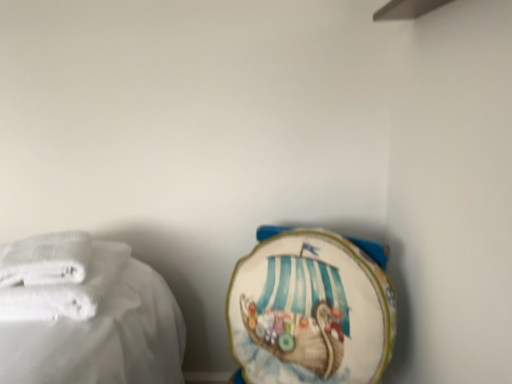
At what (x,y) coordinates should I click in order to perform the action: click on white soft towel at left, placed as the 3th towel when sorted from right to left. Please return your answer as a coordinate pair (x, y). Looking at the image, I should click on (67, 290).

This screenshot has height=384, width=512. I want to click on white fabric towel at lower right, which is counted as the 3th towel, starting from the left, so click(x=310, y=311).

The width and height of the screenshot is (512, 384). What are the coordinates of `white soft towel at left, which is the 1th towel from left to right` in the screenshot? It's located at (67, 290).

From a real-world perspective, is white soft towel at left, which is the 1th towel from left to right, over white soft towel at left, the 2th towel when ordered from right to left?

No, from a real-world perspective, white soft towel at left, which is the 1th towel from left to right, is not over white soft towel at left, the 2th towel when ordered from right to left

I want to click on towel on the left side of white soft towel at left, the 2th towel when ordered from right to left, so click(x=67, y=290).

Is white soft towel at left, placed as the 3th towel when sorted from right to left, smaller than white soft towel at left, the 2th towel when ordered from right to left?

Actually, white soft towel at left, placed as the 3th towel when sorted from right to left, might be larger than white soft towel at left, the 2th towel when ordered from right to left.

From the picture: Is white soft towel at left, placed as the 3th towel when sorted from right to left, wider or thinner than white soft towel at left, the 2th towel when ordered from right to left?

white soft towel at left, placed as the 3th towel when sorted from right to left, is wider than white soft towel at left, the 2th towel when ordered from right to left.

Measure the distance between white soft towel at left, the 2th towel when ordered from right to left, and white soft towel at left, placed as the 3th towel when sorted from right to left.

The distance of white soft towel at left, the 2th towel when ordered from right to left, from white soft towel at left, placed as the 3th towel when sorted from right to left, is 2.33 inches.

From the image's perspective, is white soft towel at left, the 2th towel when ordered from right to left, on white soft towel at left, placed as the 3th towel when sorted from right to left?

Yes, from the image's perspective, white soft towel at left, the 2th towel when ordered from right to left, is on top of white soft towel at left, placed as the 3th towel when sorted from right to left.

Can you confirm if white soft towel at left, positioned as the second towel in left-to-right order, is taller than white soft towel at left, which is the 1th towel from left to right?

No.

Who is bigger, white soft towel at left, positioned as the second towel in left-to-right order, or white soft towel at left, placed as the 3th towel when sorted from right to left?

white soft towel at left, placed as the 3th towel when sorted from right to left, is bigger.

Identify the location of towel in front of the white fabric towel at lower right, which is the 1th towel in right-to-left order. (67, 290).

Is white fabric towel at lower right, which is the 1th towel in right-to-left order, to the left of white soft towel at left, placed as the 3th towel when sorted from right to left, from the viewer's perspective?

No, white fabric towel at lower right, which is the 1th towel in right-to-left order, is not to the left of white soft towel at left, placed as the 3th towel when sorted from right to left.

Does white soft towel at left, which is the 1th towel from left to right, touch white fabric towel at lower right, which is the 1th towel in right-to-left order?

white soft towel at left, which is the 1th towel from left to right, and white fabric towel at lower right, which is the 1th towel in right-to-left order, are clearly separated.

From a real-world perspective, relative to white fabric towel at lower right, which is counted as the 3th towel, starting from the left, is white soft towel at left, which is the 1th towel from left to right, vertically above or below?

white soft towel at left, which is the 1th towel from left to right, is above white fabric towel at lower right, which is counted as the 3th towel, starting from the left.

Is point (112, 263) less distant than point (250, 354)?

No, (112, 263) is behind (250, 354).

Considering the sizes of objects white soft towel at left, which is the 1th towel from left to right, and white fabric towel at lower right, which is the 1th towel in right-to-left order, in the image provided, who is smaller, white soft towel at left, which is the 1th towel from left to right, or white fabric towel at lower right, which is the 1th towel in right-to-left order,?

white soft towel at left, which is the 1th towel from left to right, is smaller.

From the image's perspective, relative to white soft towel at left, positioned as the second towel in left-to-right order, is white fabric towel at lower right, which is the 1th towel in right-to-left order, above or below?

white fabric towel at lower right, which is the 1th towel in right-to-left order, is below white soft towel at left, positioned as the second towel in left-to-right order.

From a real-world perspective, between white fabric towel at lower right, which is counted as the 3th towel, starting from the left, and white soft towel at left, the 2th towel when ordered from right to left, who is vertically lower?

white fabric towel at lower right, which is counted as the 3th towel, starting from the left, is physically lower.

In the scene shown: Based on their sizes in the image, would you say white fabric towel at lower right, which is the 1th towel in right-to-left order, is bigger or smaller than white soft towel at left, positioned as the second towel in left-to-right order?

Considering their sizes, white fabric towel at lower right, which is the 1th towel in right-to-left order, takes up more space than white soft towel at left, positioned as the second towel in left-to-right order.

Considering the positions of point (359, 341) and point (27, 274), is point (359, 341) closer or farther from the camera than point (27, 274)?

Point (359, 341) is positioned farther from the camera compared to point (27, 274).

Does point (63, 279) appear closer or farther from the camera than point (355, 244)?

Point (63, 279) is positioned closer to the camera compared to point (355, 244).

Is white soft towel at left, positioned as the second towel in left-to-right order, bigger than white fabric towel at lower right, which is the 1th towel in right-to-left order?

Incorrect, white soft towel at left, positioned as the second towel in left-to-right order, is not larger than white fabric towel at lower right, which is the 1th towel in right-to-left order.

Is white soft towel at left, positioned as the second towel in left-to-right order, not close to white fabric towel at lower right, which is the 1th towel in right-to-left order?

Actually, white soft towel at left, positioned as the second towel in left-to-right order, and white fabric towel at lower right, which is the 1th towel in right-to-left order, are a little close together.

Looking at their sizes, would you say white soft towel at left, the 2th towel when ordered from right to left, is wider or thinner than white fabric towel at lower right, which is the 1th towel in right-to-left order?

Considering their sizes, white soft towel at left, the 2th towel when ordered from right to left, looks slimmer than white fabric towel at lower right, which is the 1th towel in right-to-left order.

Identify the location of towel that is the 1st one when counting rightward from the white soft towel at left, which is the 1th towel from left to right. This screenshot has height=384, width=512. (46, 259).

Find the location of a particular element. This screenshot has width=512, height=384. towel on the left side of white soft towel at left, positioned as the second towel in left-to-right order is located at coordinates (67, 290).

Estimate the real-world distances between objects in this image. Which object is further from white fabric towel at lower right, which is the 1th towel in right-to-left order, white soft towel at left, placed as the 3th towel when sorted from right to left, or white soft towel at left, the 2th towel when ordered from right to left?

The object further to white fabric towel at lower right, which is the 1th towel in right-to-left order, is white soft towel at left, the 2th towel when ordered from right to left.

From the image, which object appears to be farther from white soft towel at left, the 2th towel when ordered from right to left, white fabric towel at lower right, which is counted as the 3th towel, starting from the left, or white soft towel at left, placed as the 3th towel when sorted from right to left?

white fabric towel at lower right, which is counted as the 3th towel, starting from the left, lies further to white soft towel at left, the 2th towel when ordered from right to left, than the other object.

Estimate the real-world distances between objects in this image. Which object is further from white fabric towel at lower right, which is counted as the 3th towel, starting from the left, white soft towel at left, positioned as the second towel in left-to-right order, or white soft towel at left, placed as the 3th towel when sorted from right to left?

white soft towel at left, positioned as the second towel in left-to-right order, lies further to white fabric towel at lower right, which is counted as the 3th towel, starting from the left, than the other object.

Estimate the real-world distances between objects in this image. Which object is further from white soft towel at left, placed as the 3th towel when sorted from right to left, white soft towel at left, positioned as the second towel in left-to-right order, or white fabric towel at lower right, which is the 1th towel in right-to-left order?

Among the two, white fabric towel at lower right, which is the 1th towel in right-to-left order, is located further to white soft towel at left, placed as the 3th towel when sorted from right to left.

When comparing their distances from white soft towel at left, which is the 1th towel from left to right, does white fabric towel at lower right, which is the 1th towel in right-to-left order, or white soft towel at left, positioned as the second towel in left-to-right order, seem closer?

white soft towel at left, positioned as the second towel in left-to-right order, is positioned closer to the anchor white soft towel at left, which is the 1th towel from left to right.

Based on their spatial positions, is white soft towel at left, placed as the 3th towel when sorted from right to left, or white fabric towel at lower right, which is the 1th towel in right-to-left order, closer to white soft towel at left, positioned as the second towel in left-to-right order?

white soft towel at left, placed as the 3th towel when sorted from right to left.

Identify the location of towel between white soft towel at left, placed as the 3th towel when sorted from right to left, and white fabric towel at lower right, which is the 1th towel in right-to-left order, from left to right. (46, 259).